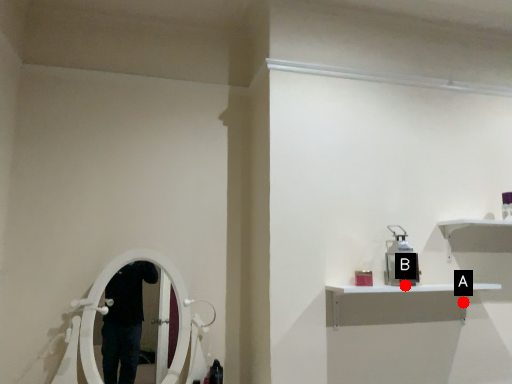
Question: Two points are circled on the image, labeled by A and B beside each circle. Which point is farther from the camera taking this photo?

Choices:
 (A) A is further
 (B) B is further

Answer: (A)